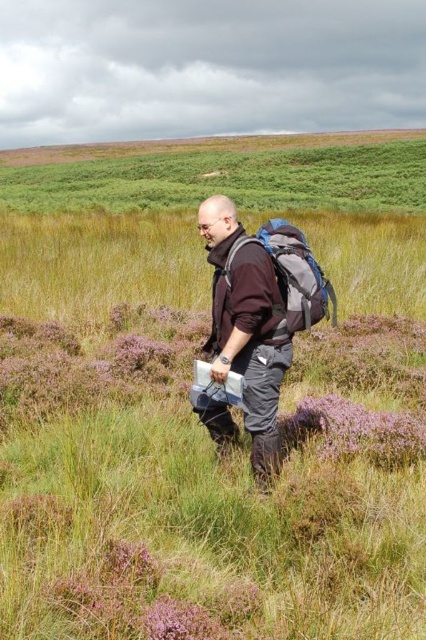
Question: Is matte black jacket at center to the right of matte gray backpack at center from the viewer's perspective?

Choices:
 (A) no
 (B) yes

Answer: (A)

Question: In this image, where is matte black jacket at center located relative to matte gray backpack at center?

Choices:
 (A) right
 (B) left

Answer: (B)

Question: Which object is farther from the camera taking this photo?

Choices:
 (A) matte gray backpack at center
 (B) matte black jacket at center

Answer: (A)

Question: Which of the following is the closest to the observer?

Choices:
 (A) (291, 236)
 (B) (265, 416)

Answer: (B)

Question: Which object appears farthest from the camera in this image?

Choices:
 (A) matte black jacket at center
 (B) matte gray backpack at center

Answer: (B)

Question: Does matte black jacket at center appear on the left side of matte gray backpack at center?

Choices:
 (A) no
 (B) yes

Answer: (B)